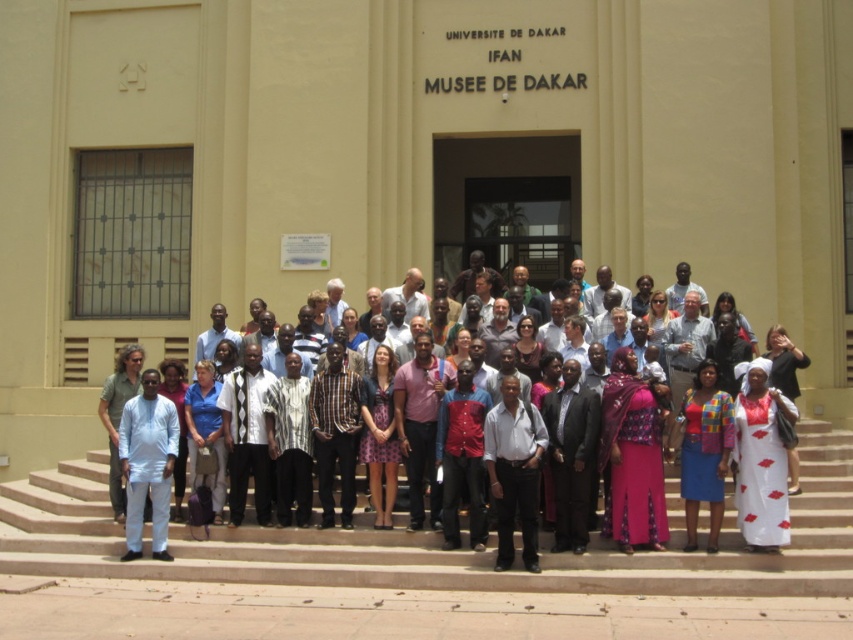
Is point (579, 504) closer to camera compared to point (746, 458)?

No.

Who is lower down, matte white shirt at center or white printed dress at center?

white printed dress at center is below.

At what (x,y) coordinates should I click in order to perform the action: click on matte white shirt at center. Please return your answer as a coordinate pair (x, y). This screenshot has height=640, width=853. Looking at the image, I should click on [x=531, y=445].

Locate an element on the screen. This screenshot has width=853, height=640. matte white shirt at center is located at coordinates (x=531, y=445).

Which of these two, matte white shirt at center or beige concrete stairs at center, stands shorter?

beige concrete stairs at center

Does matte white shirt at center appear on the left side of beige concrete stairs at center?

No, matte white shirt at center is not to the left of beige concrete stairs at center.

Where is `matte white shirt at center`? Image resolution: width=853 pixels, height=640 pixels. matte white shirt at center is located at coordinates (531, 445).

The height and width of the screenshot is (640, 853). Identify the location of matte white shirt at center. (531, 445).

Between white printed dress at center and light blue fabric shirt at center, which one has more height?

Standing taller between the two is light blue fabric shirt at center.

Locate an element on the screen. white printed dress at center is located at coordinates (759, 458).

Where is `white printed dress at center`? white printed dress at center is located at coordinates (759, 458).